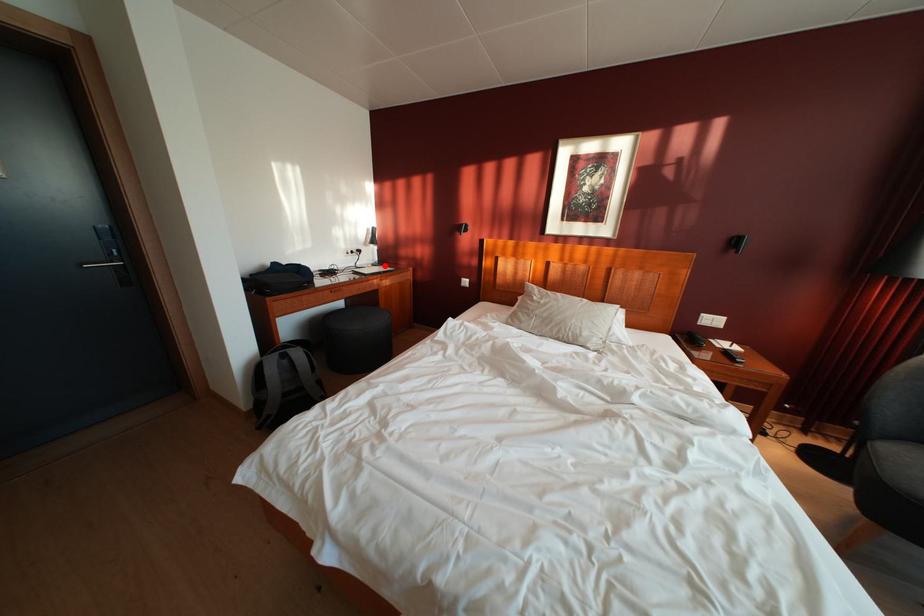
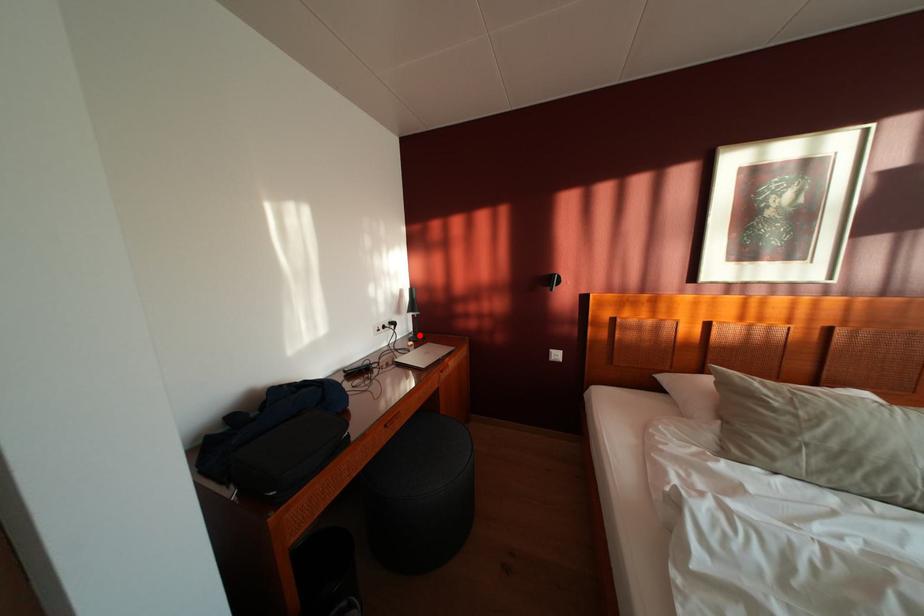
I am providing you with two images of the same scene from different viewpoints. A red point is marked on the first image and another point is marked on the second image. Is the marked point in image1 the same physical position as the marked point in image2?

Yes